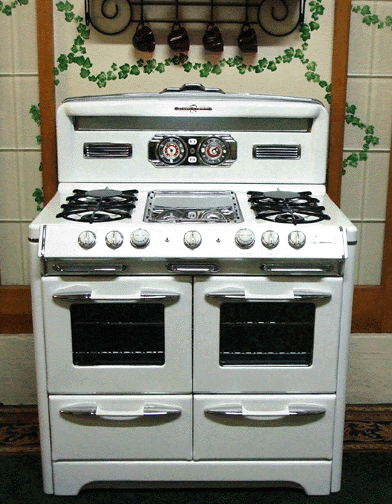
I want to click on front left burner, so click(98, 209).